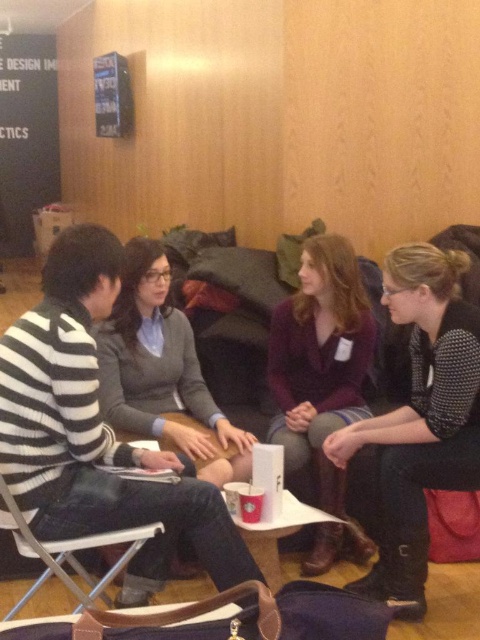
You are a delivery person who needs to place a package between the matte gray sweater at center and the metallic silver folding chair at lower left. The package is 70 centimeters long. Will it fit in the space between them?

The distance between the matte gray sweater at center and the metallic silver folding chair at lower left is 75.47 centimeters. Since the package is 70 centimeters long, it will fit with some space remaining.

You are a photographer trying to capture a candid shot of the group. You notice the black dotted shirt at right and the purple velvet blazer at center. Which clothing item is blocking the view of the other?

The black dotted shirt at right is in front of the purple velvet blazer at center, so it is blocking the view of the purple velvet blazer at center.

You are standing at the origin of the coordinate system in the image. You need to move to the point at (208, 422). Is the point at (300, 394) in front of or behind your path to the target point?

The point at (300, 394) is behind point (208, 422), so it is behind your path to the target point.